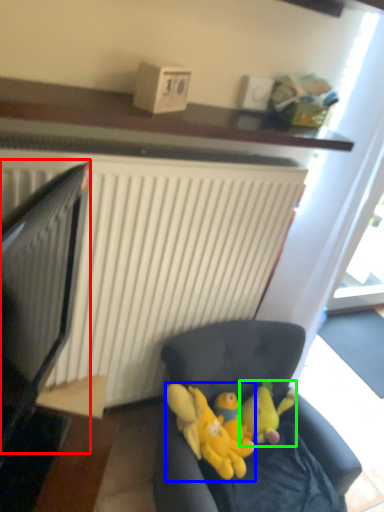
Question: Based on their relative distances, which object is nearer to computer monitor (highlighted by a red box)? Choose from toy (highlighted by a blue box) and toy (highlighted by a green box).

Choices:
 (A) toy
 (B) toy

Answer: (A)